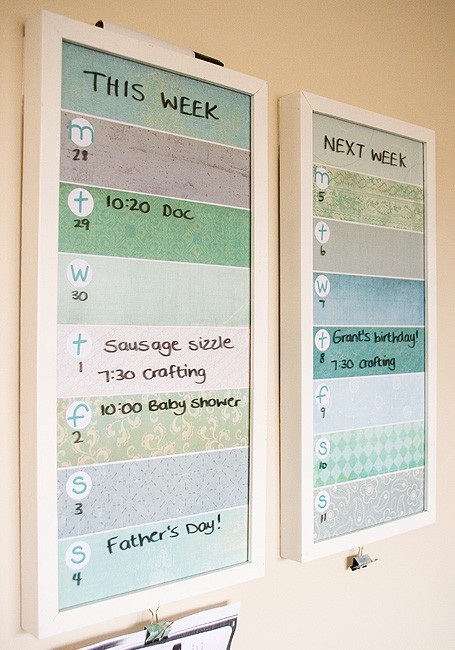
The height and width of the screenshot is (650, 455). Find the location of `white picture frame`. white picture frame is located at coordinates (47, 563).